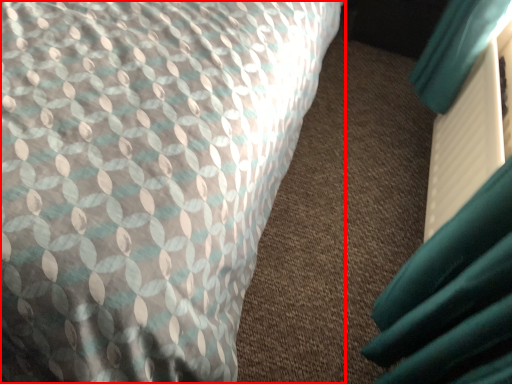
Question: From the image, what is the correct spatial relationship of bed (annotated by the red box) in relation to paperback book?

Choices:
 (A) right
 (B) left

Answer: (B)